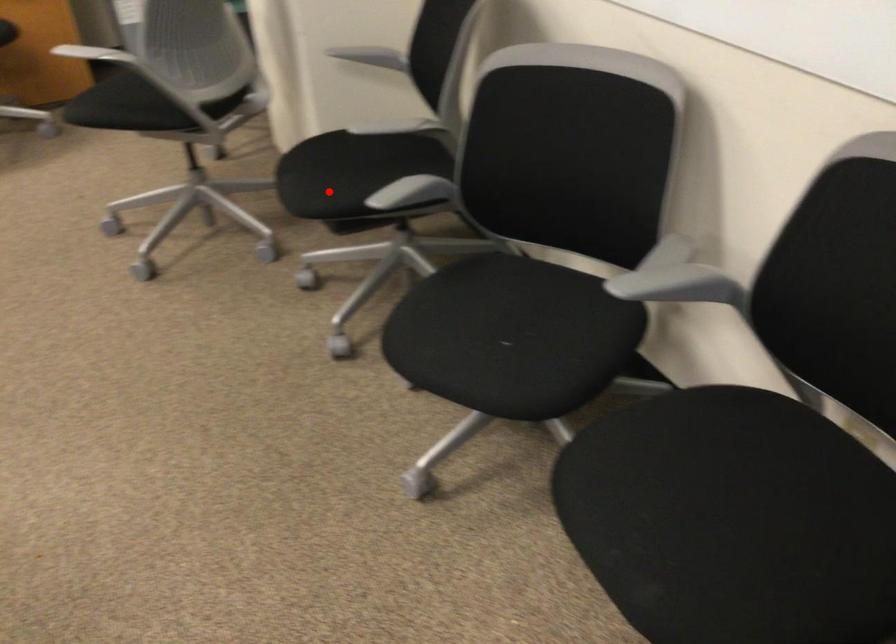
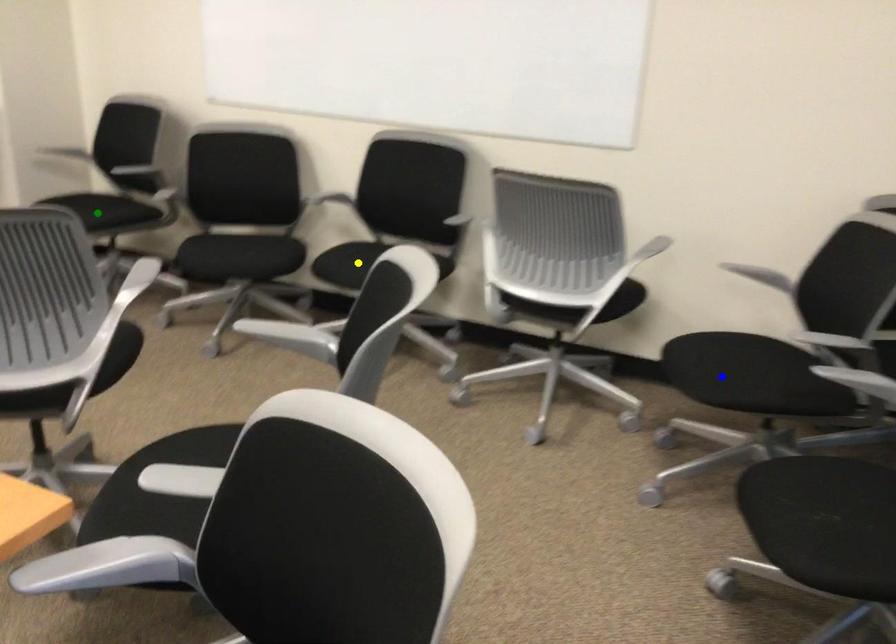
Question: I am providing you with two images of the same scene from different viewpoints. A red point is marked on the first image. You are given multiple points on the second image. Which mark in image 2 goes with the point in image 1?

Choices:
 (A) blue point
 (B) green point
 (C) yellow point

Answer: (B)